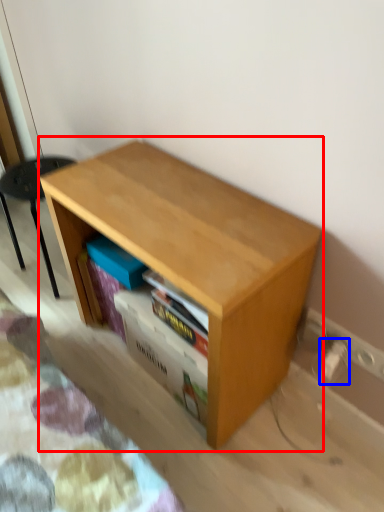
Question: Among these objects, which one is farthest to the camera, table (highlighted by a red box) or electric outlet (highlighted by a blue box)?

Choices:
 (A) table
 (B) electric outlet

Answer: (B)